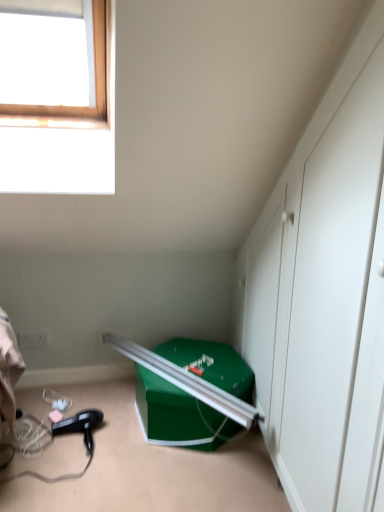
The height and width of the screenshot is (512, 384). Find the location of `vacant space to the right of black plastic hair dryer at lower left`. vacant space to the right of black plastic hair dryer at lower left is located at coordinates (130, 442).